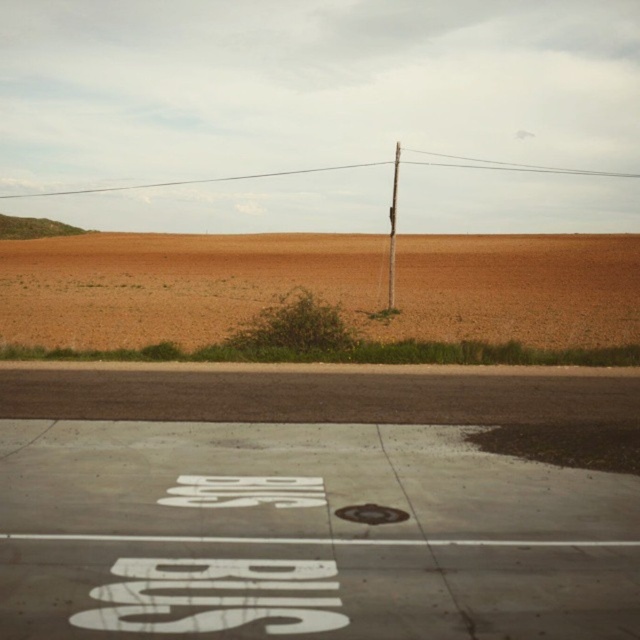
You are a pedestrian standing at the edge of the paved area marked with the word BUS. You need to walk to the smooth wood pole at center. Which direction should you walk relative to the brown grassland at center?

You should walk to the right of the brown grassland at center because the smooth wood pole at center is positioned on the right side of the brown grassland at center.

You are a delivery drone that needs to land on the white painted concrete at center. The smooth wood pole at center is in the way. Can you land safely?

The white painted concrete at center occupies less space than the smooth wood pole at center, so there might not be enough room for the drone to land safely. Choose another spot.